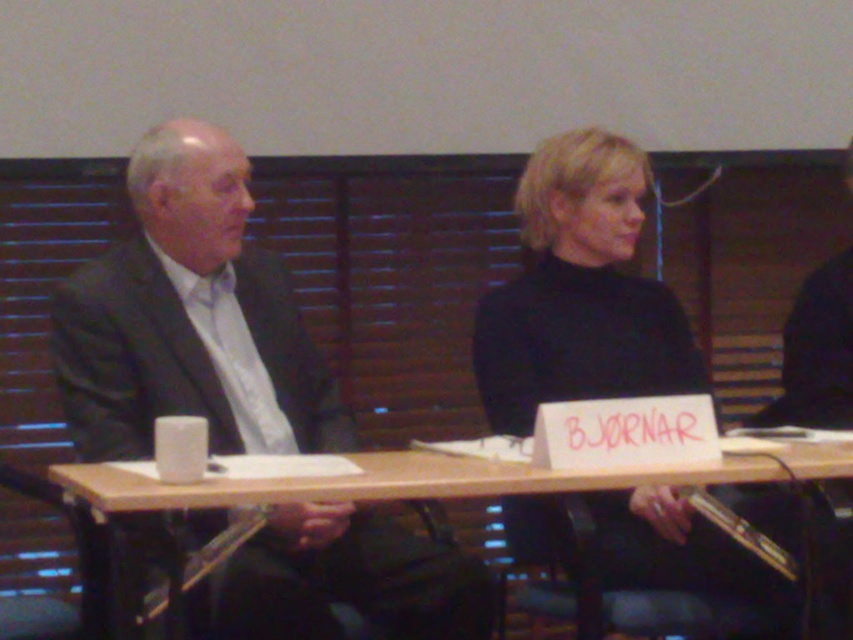
Is point (225, 348) in front of point (137, 499)?

No, it is behind (137, 499).

Can you confirm if dark gray suit at left is shorter than wooden table at center?

No.

This screenshot has height=640, width=853. In order to click on dark gray suit at left in this screenshot , I will do `click(189, 317)`.

How far apart are black matte turtleneck at center and wooden table at center?

black matte turtleneck at center is 18.60 inches away from wooden table at center.

Which is in front, point (550, 260) or point (273, 493)?

Point (273, 493)

The image size is (853, 640). Identify the location of black matte turtleneck at center. (579, 292).

You are a GUI agent. You are given a task and a screenshot of the screen. Output one action in this format:
    pyautogui.click(x=<x>, y=<y>)
    Task: Click on the black matte turtleneck at center
    This screenshot has height=640, width=853.
    Given the screenshot: What is the action you would take?
    pyautogui.click(x=579, y=292)

Can you confirm if dark gray suit at left is shorter than black matte turtleneck at center?

Yes, dark gray suit at left is shorter than black matte turtleneck at center.

Is the position of dark gray suit at left less distant than that of black matte turtleneck at center?

Yes.

Is point (143, 248) farther from camera compared to point (654, 547)?

No.

Identify the location of dark gray suit at left. 189,317.